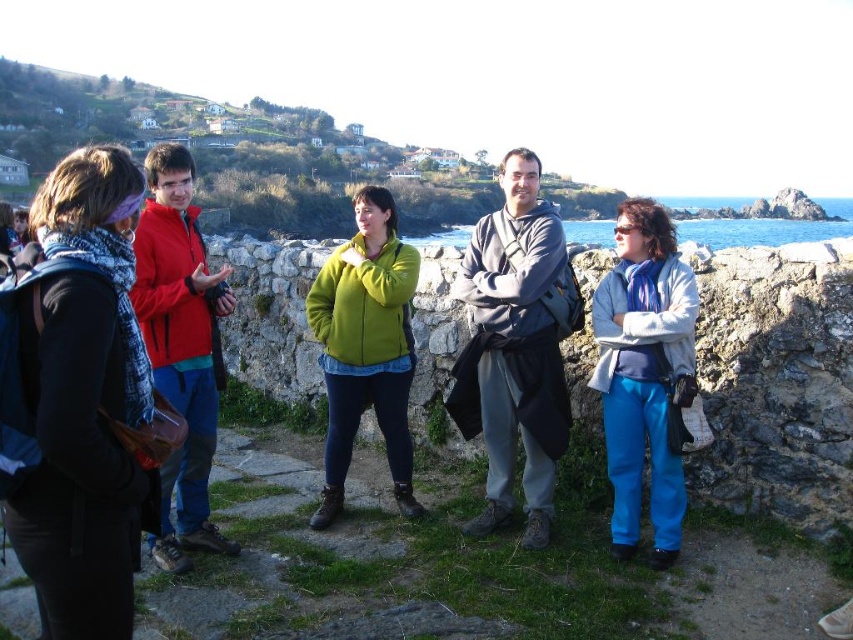
Is gray hoodie at center bigger than blue fabric pants at center?

Correct, gray hoodie at center is larger in size than blue fabric pants at center.

Is the position of gray hoodie at center more distant than that of blue fabric pants at center?

Yes.

Who is more forward, [486,284] or [625,422]?

Point [625,422] is more forward.

The height and width of the screenshot is (640, 853). What are the coordinates of `gray hoodie at center` in the screenshot? It's located at (514, 348).

Is gray hoodie at center above red jacket at left?

Correct, gray hoodie at center is located above red jacket at left.

Is gray hoodie at center smaller than red jacket at left?

Yes, gray hoodie at center is smaller than red jacket at left.

Locate an element on the screen. This screenshot has height=640, width=853. gray hoodie at center is located at coordinates (514, 348).

Is blue fabric pants at center smaller than green fleece jacket at center?

Incorrect, blue fabric pants at center is not smaller in size than green fleece jacket at center.

Is point (643, 376) behind point (403, 355)?

No, it is not.

This screenshot has width=853, height=640. Find the location of `blue fabric pants at center`. blue fabric pants at center is located at coordinates (643, 372).